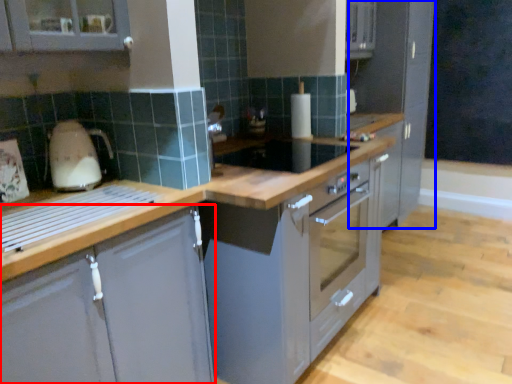
Question: Which of the following is the closest to the observer, cabinetry (highlighted by a red box) or cabinetry (highlighted by a blue box)?

Choices:
 (A) cabinetry
 (B) cabinetry

Answer: (A)